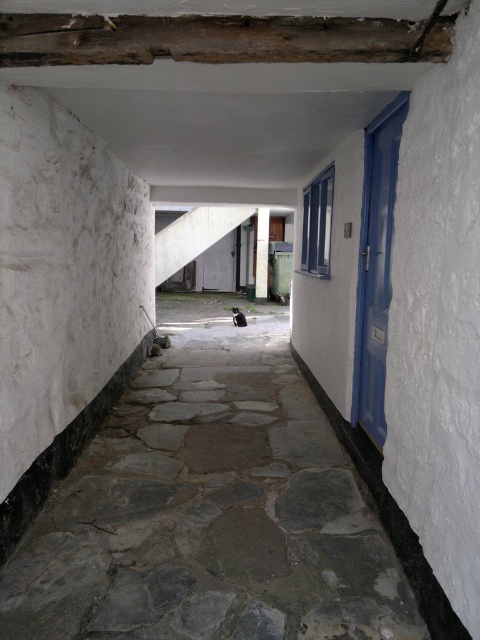
You are a delivery person carrying a large box that is 1.2 meters wide. You need to navigate through the corridor shown in the image. Can you pass through the gray stone path at center without tilting the box? Please consider the width of the wooden beam at upper center as well.

The gray stone path at center might be wider than wooden beam at upper center, so it is possible that the path is wide enough for the 1.2 meter wide box. However, since the beam is above, its width does not affect the path width. You should be able to pass through the gray stone path at center without tilting the box.

You are standing in the corridor and want to hang a decorative banner that requires at least 30 cm of vertical space. Given the wooden beam at upper center and the blue painted wood door at right, which one allows enough vertical space for the banner?

The blue painted wood door at right allows enough vertical space for the banner since the wooden beam at upper center has a lesser height compared to it.

You are a delivery person carrying a large package and need to navigate through the corridor. The gray stone path at center is the only clear path available. Can you pass through the corridor without touching the blue painted wood door at right?

The gray stone path at center occupies less space than the blue painted wood door at right, so yes, the delivery person can pass through the corridor without touching the blue painted wood door at right since the path is narrower than the door.